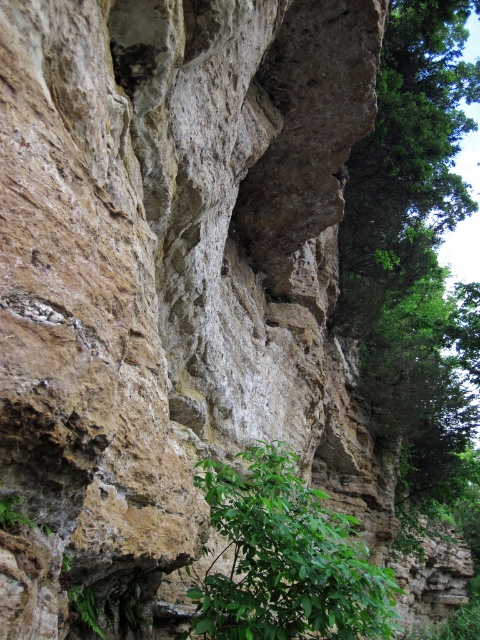
Question: Is green leafy plant at lower center above green leafy tree at upper right?

Choices:
 (A) no
 (B) yes

Answer: (A)

Question: Does green leafy plant at lower center come behind green leafy tree at upper right?

Choices:
 (A) no
 (B) yes

Answer: (A)

Question: Which point is farther from the camera taking this photo?

Choices:
 (A) (269, 468)
 (B) (348, 237)

Answer: (B)

Question: Which object is closer to the camera taking this photo?

Choices:
 (A) green leafy plant at lower center
 (B) green leafy tree at upper right

Answer: (A)

Question: Is green leafy plant at lower center to the left of green leafy tree at upper right from the viewer's perspective?

Choices:
 (A) yes
 (B) no

Answer: (A)